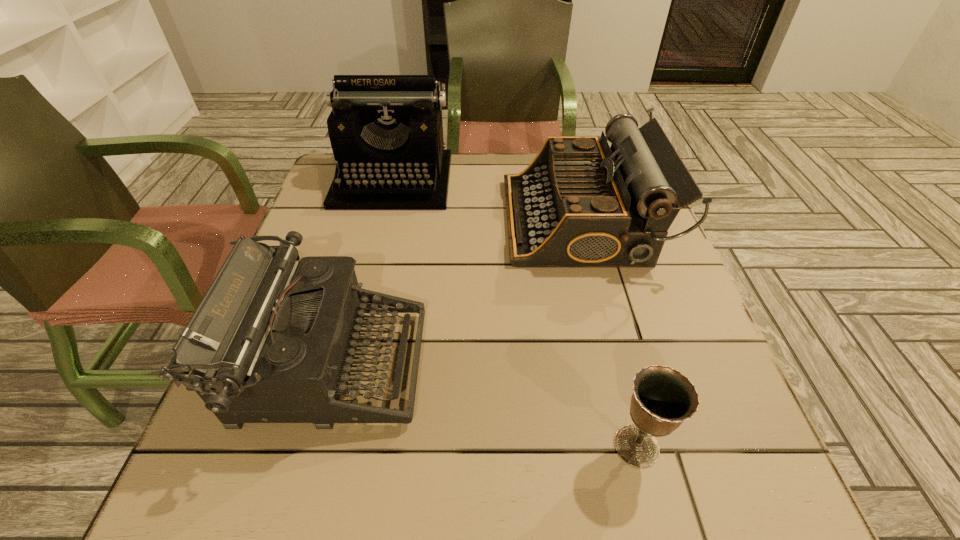
You are a GUI agent. You are given a task and a screenshot of the screen. Output one action in this format:
    pyautogui.click(x=<x>, y=<y>)
    Task: Click on the tallest object
    
    Given the screenshot: What is the action you would take?
    pyautogui.click(x=386, y=132)

Find the location of `the rightmost typewriter`. the rightmost typewriter is located at coordinates (580, 204).

Image resolution: width=960 pixels, height=540 pixels. I want to click on the nearest typewriter, so click(271, 341).

The image size is (960, 540). Identify the location of chalice. (663, 398).

Where is `vacant space situated on the typing side of the tallest typewriter`? vacant space situated on the typing side of the tallest typewriter is located at coordinates [x=361, y=307].

The width and height of the screenshot is (960, 540). Find the location of `blank space located on the keyboard of the rightmost typewriter`. blank space located on the keyboard of the rightmost typewriter is located at coordinates (374, 220).

This screenshot has height=540, width=960. I want to click on vacant area located on the keyboard of the rightmost typewriter, so click(x=478, y=220).

The height and width of the screenshot is (540, 960). Find the location of `vacant space located 0.050m on the keyboard of the rightmost typewriter`. vacant space located 0.050m on the keyboard of the rightmost typewriter is located at coordinates click(x=486, y=220).

The width and height of the screenshot is (960, 540). I want to click on vacant region located on the typing side of the nearest typewriter, so click(541, 366).

At what (x,y) coordinates should I click in order to perform the action: click on free space located on the back of the chalice. Please return your answer as a coordinate pair (x, y). The height and width of the screenshot is (540, 960). Looking at the image, I should click on (619, 378).